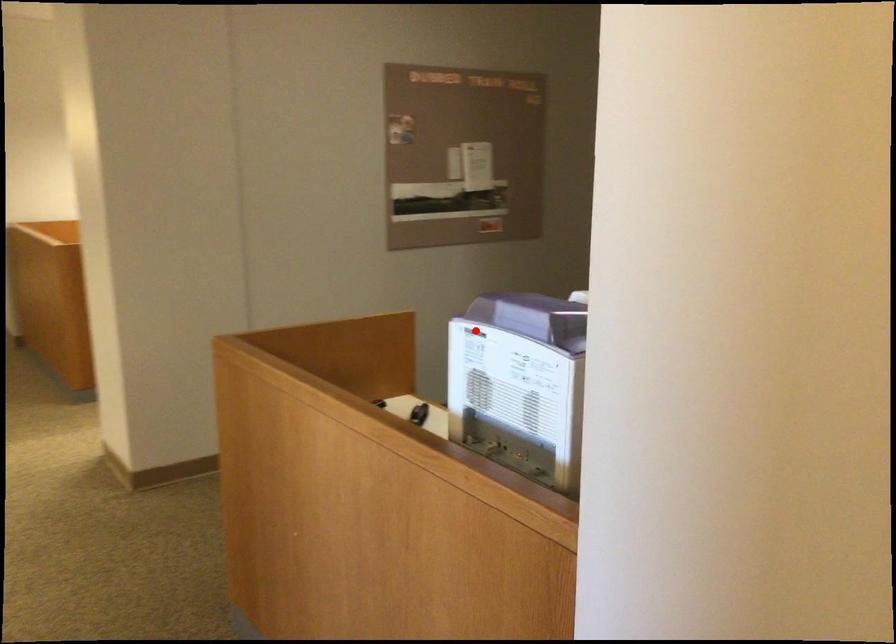
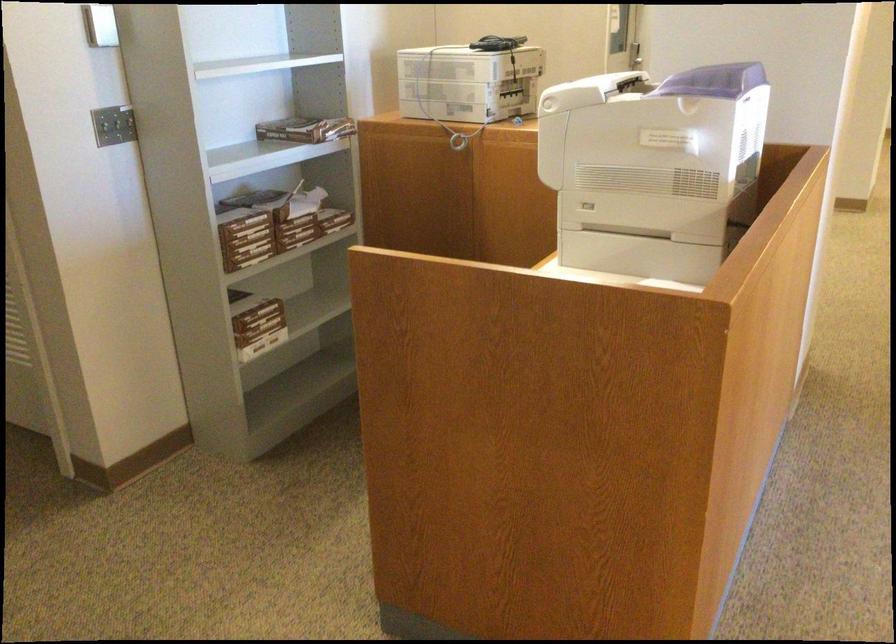
Locate, in the second image, the point that corresponds to the highlighted location in the first image.

(714, 80)